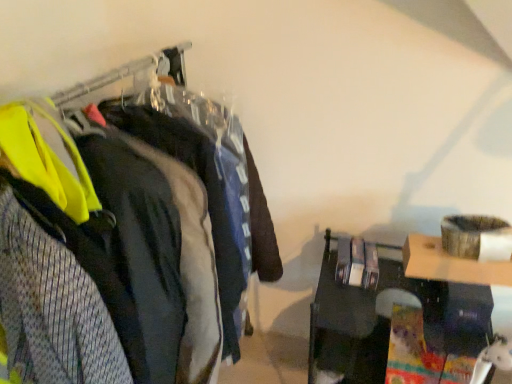
Question: Is yellow reflective vest at left, which is counted as the 1th clothing, starting from the front, facing towards matte black jacket at left, positioned as the second clothing in front-to-back order?

Choices:
 (A) no
 (B) yes

Answer: (A)

Question: Considering the relative sizes of yellow reflective vest at left, which is counted as the 1th clothing, starting from the front, and matte black jacket at left, positioned as the second clothing in front-to-back order, in the image provided, is yellow reflective vest at left, which is counted as the 1th clothing, starting from the front, thinner than matte black jacket at left, positioned as the second clothing in front-to-back order,?

Choices:
 (A) yes
 (B) no

Answer: (B)

Question: Does yellow reflective vest at left, which is counted as the 1th clothing, starting from the front, appear on the right side of matte black jacket at left, positioned as the second clothing in front-to-back order?

Choices:
 (A) yes
 (B) no

Answer: (B)

Question: Is yellow reflective vest at left, which is counted as the 1th clothing, starting from the front, looking in the opposite direction of matte black jacket at left, the first clothing in the back-to-front sequence?

Choices:
 (A) no
 (B) yes

Answer: (A)

Question: Is yellow reflective vest at left, which is counted as the 1th clothing, starting from the front, next to matte black jacket at left, the first clothing in the back-to-front sequence?

Choices:
 (A) no
 (B) yes

Answer: (A)

Question: Can you confirm if yellow reflective vest at left, which is counted as the 1th clothing, starting from the front, is smaller than matte black jacket at left, positioned as the second clothing in front-to-back order?

Choices:
 (A) yes
 (B) no

Answer: (B)

Question: Is matte black jacket at left not within black glossy table at lower right?

Choices:
 (A) no
 (B) yes

Answer: (B)

Question: From a real-world perspective, is matte black jacket at left on top of black glossy table at lower right?

Choices:
 (A) no
 (B) yes

Answer: (B)

Question: Is there a large distance between matte black jacket at left and black glossy table at lower right?

Choices:
 (A) no
 (B) yes

Answer: (A)

Question: Is matte black jacket at left in front of black glossy table at lower right?

Choices:
 (A) yes
 (B) no

Answer: (A)

Question: Considering the relative sizes of matte black jacket at left and black glossy table at lower right in the image provided, is matte black jacket at left smaller than black glossy table at lower right?

Choices:
 (A) yes
 (B) no

Answer: (B)

Question: Is matte black jacket at left turned away from black glossy table at lower right?

Choices:
 (A) no
 (B) yes

Answer: (A)

Question: From the image's perspective, is matte black jacket at left located above yellow reflective vest at left, which is counted as the second clothing, starting from the back?

Choices:
 (A) yes
 (B) no

Answer: (B)